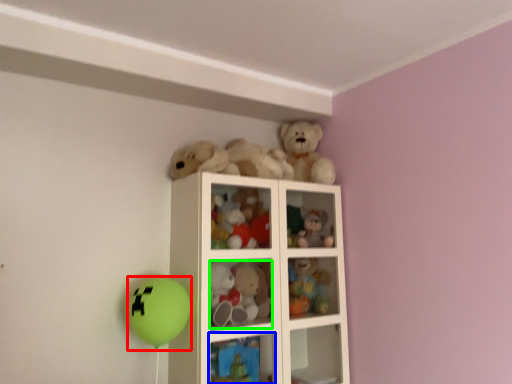
Question: Based on their relative distances, which object is farther from balloon (highlighted by a red box)? Choose from cabinet (highlighted by a blue box) and toy (highlighted by a green box).

Choices:
 (A) cabinet
 (B) toy

Answer: (A)